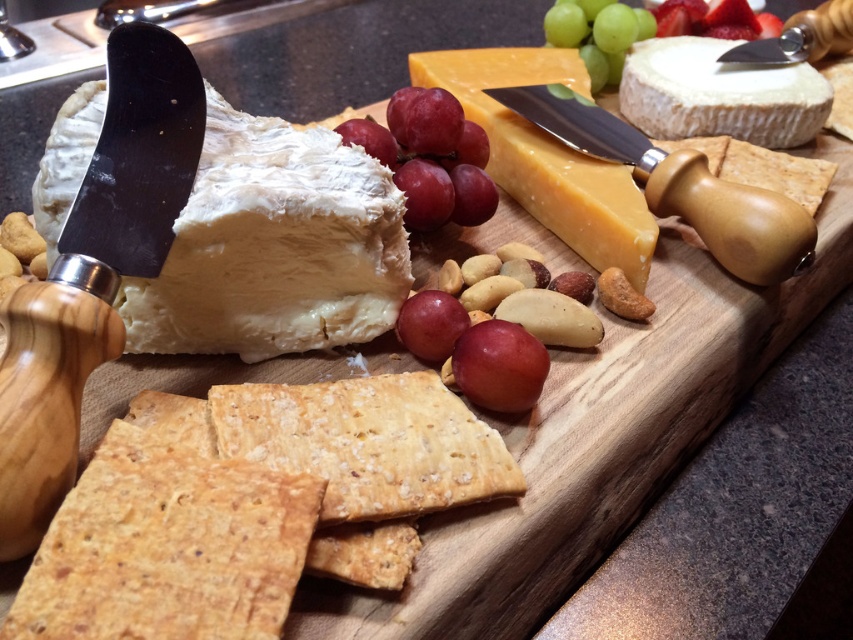
Question: Does red matte grape at center appear on the right side of green matte grape at upper center?

Choices:
 (A) yes
 (B) no

Answer: (B)

Question: Is white creamy cheese at left above smooth red strawberries at upper right?

Choices:
 (A) yes
 (B) no

Answer: (B)

Question: Which is nearer to the red matte grape at center?

Choices:
 (A) white creamy cheese at upper right
 (B) white creamy cheese at left

Answer: (B)

Question: Which object appears farthest from the camera in this image?

Choices:
 (A) shiny purple grapes at center
 (B) white creamy cheese at left
 (C) hard yellow cheese at center

Answer: (C)

Question: Is white creamy cheese at upper right wider than green matte grape at upper center?

Choices:
 (A) no
 (B) yes

Answer: (B)

Question: Which point appears farthest from the camera in this image?

Choices:
 (A) (610, 56)
 (B) (750, 131)

Answer: (A)